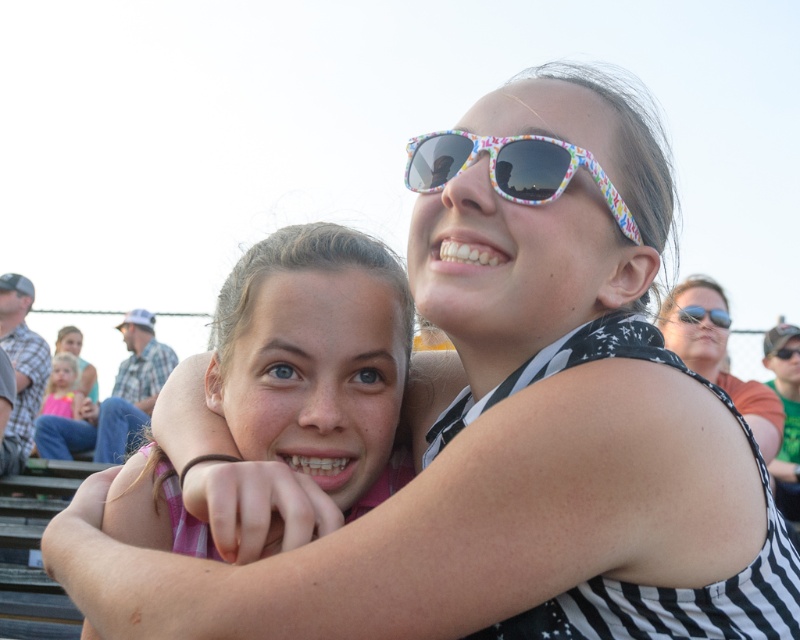
You are standing in front of the image and want to locate the pink fabric at center. According to the coordinates provided, where would you look?

The pink fabric at center is located at point (314, 356).

You are standing at the back of the bleachers and want to take a photo of the two people in the foreground. Which point, point [529,160] or point [690,365], is closer to you?

Point [529,160] is in front of point [690,365], so the closer point to you is point [690,365].

You are standing in the center of the image and want to locate the black and white striped shirt at upper right. Based on the coordinates provided, in which direction should you look to find it?

The black and white striped shirt at upper right is located at coordinates point (717, 355), so you should look to the upper right direction to find it.